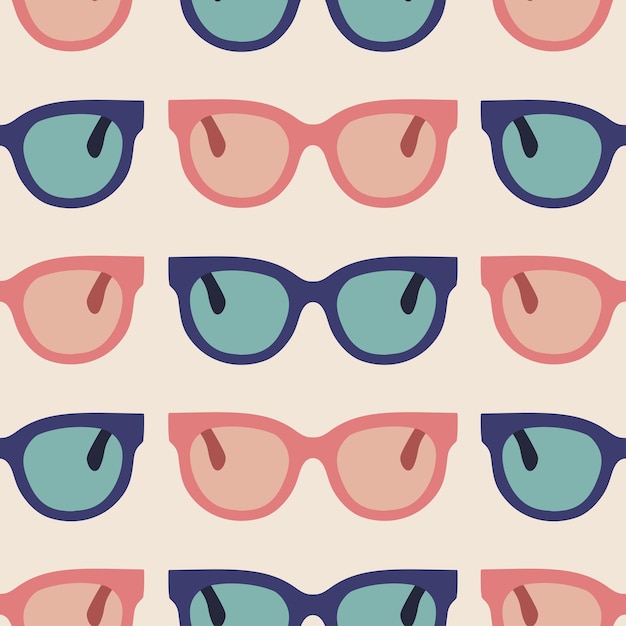
At what (x,y) coordinates should I click in order to perform the action: click on middle row of glasses. Please return your answer as a coordinate pair (x, y). The width and height of the screenshot is (626, 626). Looking at the image, I should click on coord(523,278), coord(355,290), coord(240,290), coord(81,315).